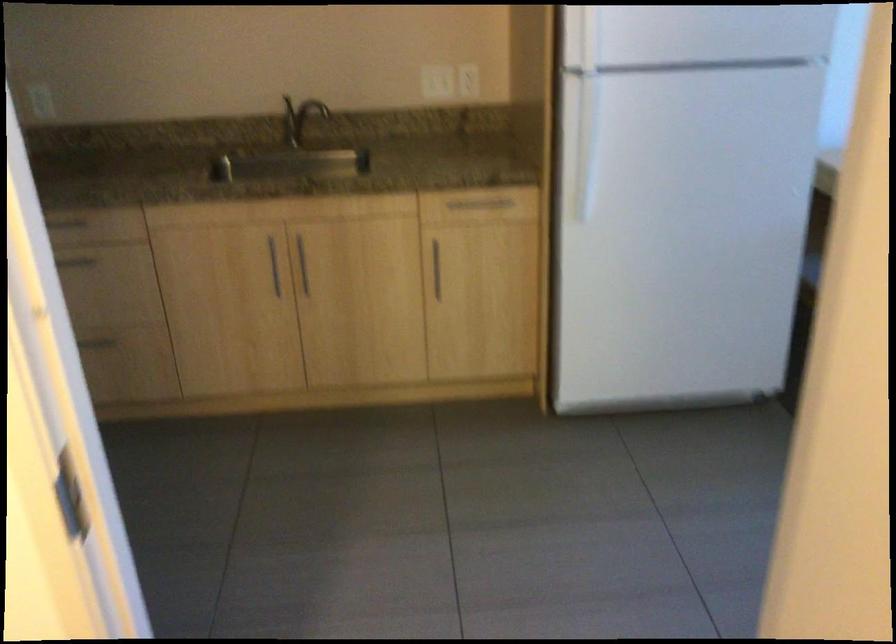
Find where to pull the freezer door handle. Please return your answer as a coordinate pair (x, y).

(581, 39)